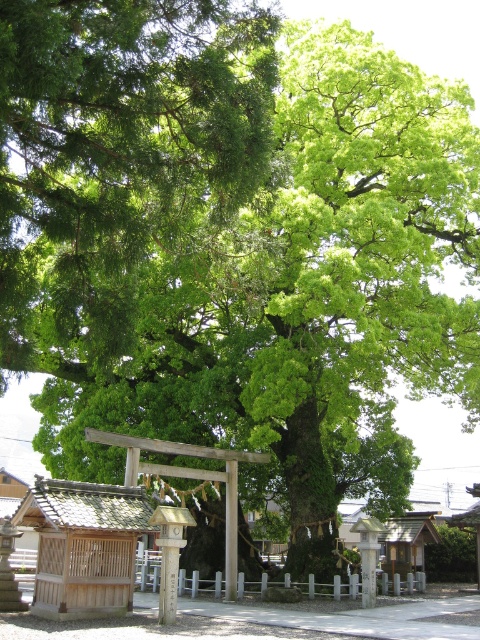
Does green leafy tree at center appear on the left side of wooden post at center?

Correct, you'll find green leafy tree at center to the left of wooden post at center.

Is green leafy tree at center below wooden post at center?

No, green leafy tree at center is not below wooden post at center.

Who is more distant from viewer, (101, 65) or (170, 595)?

The point (170, 595) is more distant.

What are the coordinates of `green leafy tree at center` in the screenshot? It's located at (117, 157).

Looking at this image, who is positioned more to the left, wooden post at center or wooden shrine at center?

wooden post at center is more to the left.

Is wooden post at center thinner than wooden shrine at center?

Yes, wooden post at center is thinner than wooden shrine at center.

What do you see at coordinates (169, 554) in the screenshot? The image size is (480, 640). I see `wooden post at center` at bounding box center [169, 554].

The height and width of the screenshot is (640, 480). In order to click on wooden post at center in this screenshot , I will do `click(169, 554)`.

Can you confirm if wooden post at center is positioned above matte wood post at center?

Indeed, wooden post at center is positioned over matte wood post at center.

Is wooden post at center thinner than matte wood post at center?

No.

Measure the distance between point (x=168, y=577) and camera.

The distance of point (x=168, y=577) from camera is 56.32 feet.

Find the location of `wooden post at center`. wooden post at center is located at coordinates (169, 554).